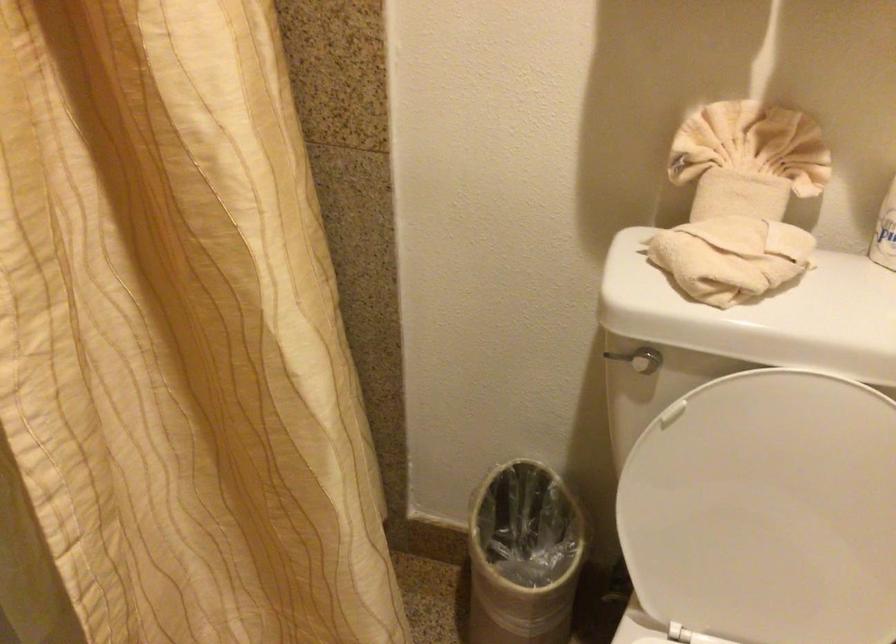
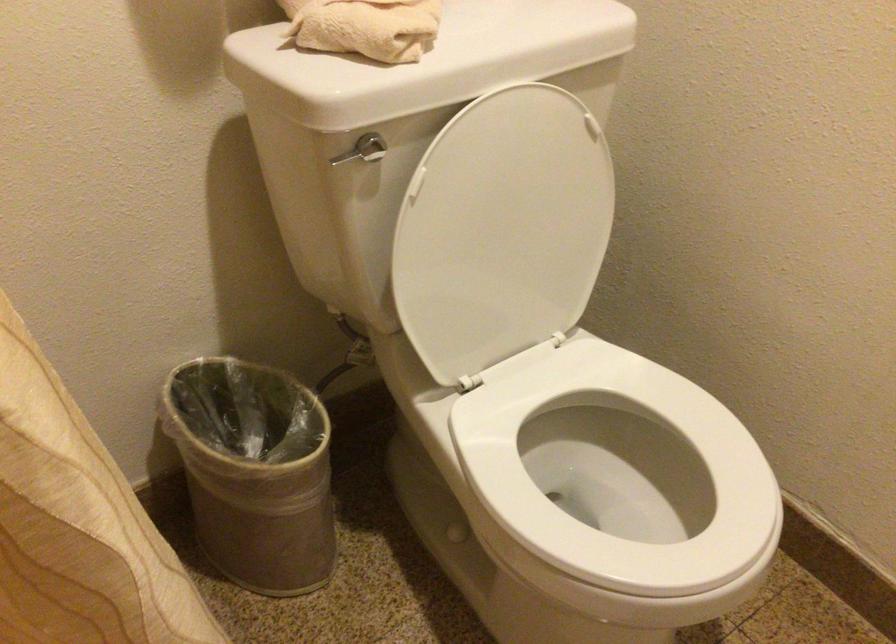
The point at (x=770, y=507) is marked in the first image. Where is the corresponding point in the second image?

(502, 230)